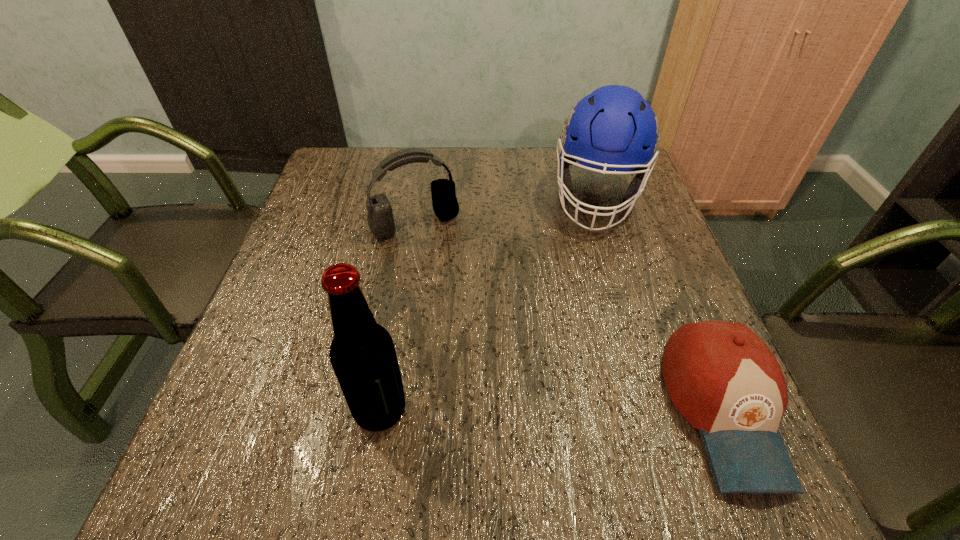
Locate an element on the screen. The height and width of the screenshot is (540, 960). vacant space at the left edge is located at coordinates (269, 339).

What are the coordinates of `vacant space at the right edge of the desktop` in the screenshot? It's located at (631, 258).

The image size is (960, 540). In the image, there is a desktop. Identify the location of vacant space at the far left corner. (374, 163).

The height and width of the screenshot is (540, 960). In order to click on free spot between the shortest object and the beer bottle in this screenshot , I will do `click(552, 410)`.

Locate an element on the screen. This screenshot has height=540, width=960. empty space between the baseball cap and the beer bottle is located at coordinates (552, 410).

Identify the location of unoccupied position between the football helmet and the third tallest object. This screenshot has height=540, width=960. (507, 211).

Identify the location of free space between the beer bottle and the headset. The image size is (960, 540). (398, 316).

I want to click on vacant area between the beer bottle and the headset, so click(x=398, y=316).

Image resolution: width=960 pixels, height=540 pixels. I want to click on empty space between the beer bottle and the second shortest object, so click(398, 316).

Where is `vacant area that lies between the second shortest object and the beer bottle`? This screenshot has width=960, height=540. vacant area that lies between the second shortest object and the beer bottle is located at coordinates (398, 316).